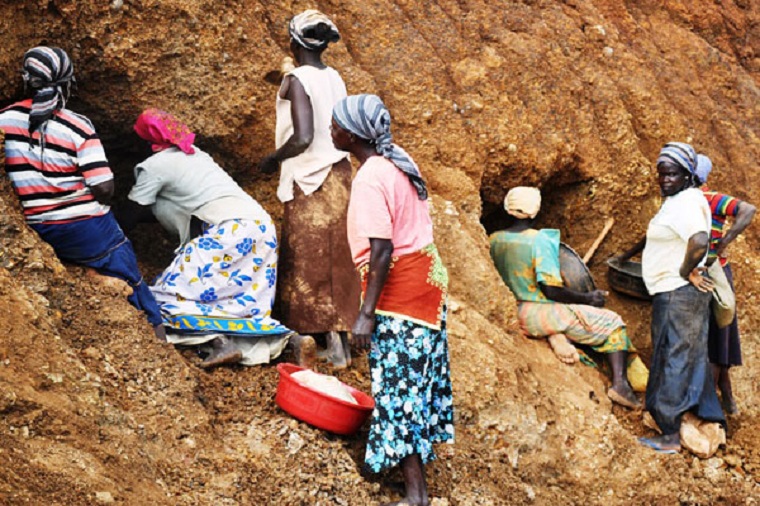
I want to click on rod, so click(593, 246).